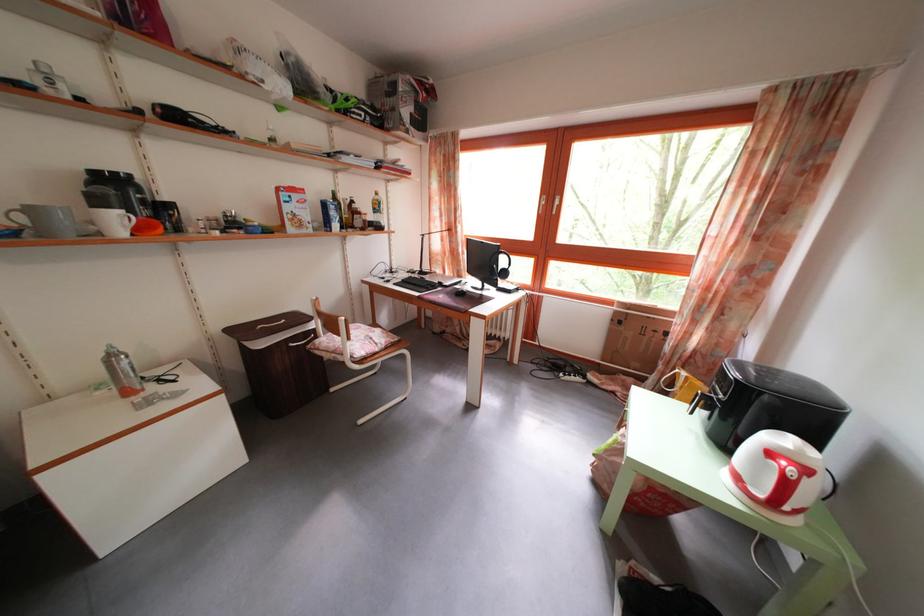
Where would you lift the cardboard box? Please return your answer as a coordinate pair (x, y).

(636, 338)